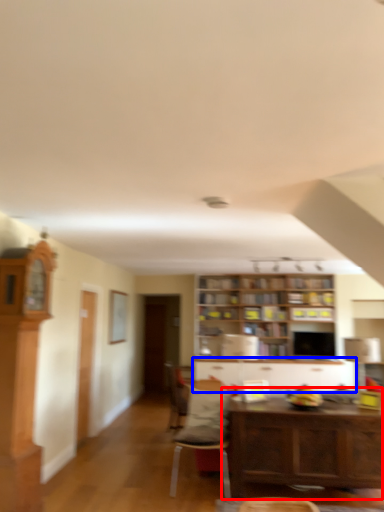
Question: Which object appears farthest to the camera in this image, table (highlighted by a red box) or cabinetry (highlighted by a blue box)?

Choices:
 (A) table
 (B) cabinetry

Answer: (B)